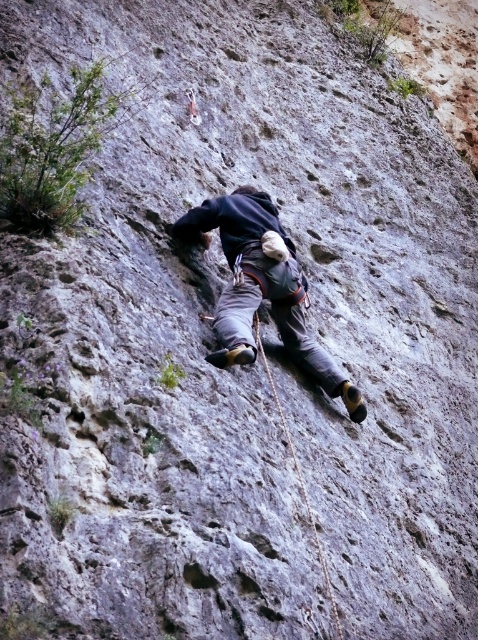
You are a rock climber attempting to reach the top of the cliff. You are currently at point (302, 332). The nearest handhold is 38.08 meters away from your current position. Can you safely reach the next handhold with your current grip?

The nearest handhold is 38.08 meters away from your current position at point (302, 332). Since this distance is too far to reach with a normal grip, you cannot safely reach the next handhold.

You are a rock climber assessing the safety of your gear. You notice the dark gray fabric climbing harness at center and the rope at center. Which object is closer to you, the climber?

The dark gray fabric climbing harness at center is closer to you than the rope at center because it is positioned further to the viewer, meaning it is in front of the rope.

You are a rock climber trying to reach the top of the cliff. You notice a dark gray fabric climbing harness at center marked by point (262, 289). Is this point located above or below the midpoint of your body?

The point (262, 289) represents the dark gray fabric climbing harness at center, which is typically worn around the waist. Since the waist is below the midpoint of the body, this point is located below the midpoint of your body.